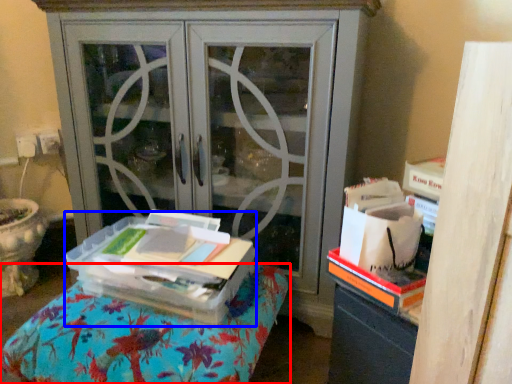
Question: Among these objects, which one is farthest to the camera, furniture (highlighted by a red box) or cardboard box (highlighted by a blue box)?

Choices:
 (A) furniture
 (B) cardboard box

Answer: (B)